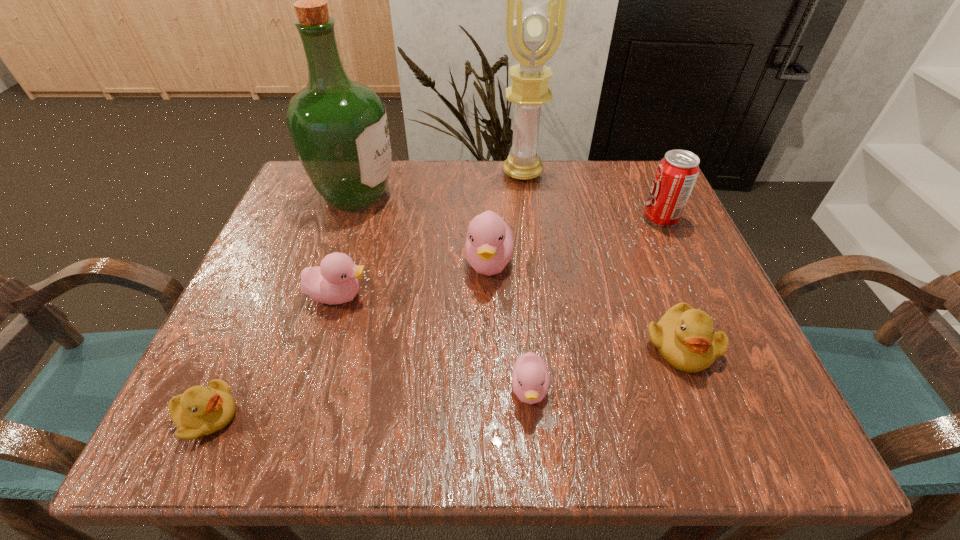
Identify the location of liquor. (339, 128).

Where is `award`? The image size is (960, 540). award is located at coordinates 534,34.

The width and height of the screenshot is (960, 540). In order to click on soda in this screenshot , I will do tap(676, 174).

You are a GUI agent. You are given a task and a screenshot of the screen. Output one action in this format:
    pyautogui.click(x=<x>, y=<y>)
    Task: Click on the fourth tallest object
    Image resolution: width=960 pixels, height=540 pixels.
    Given the screenshot: What is the action you would take?
    pyautogui.click(x=489, y=244)

At what (x,y) coordinates should I click in order to perform the action: click on the biggest pink duckling. Please return your answer as a coordinate pair (x, y). Image resolution: width=960 pixels, height=540 pixels. Looking at the image, I should click on (489, 244).

The width and height of the screenshot is (960, 540). I want to click on the leftmost pink duckling, so click(335, 281).

Locate an element on the screen. the second smallest pink duckling is located at coordinates (335, 281).

Locate an element on the screen. The height and width of the screenshot is (540, 960). the rightmost duckling is located at coordinates (685, 337).

This screenshot has width=960, height=540. In order to click on the right yellow duckling in this screenshot , I will do 685,337.

Identify the location of the nearest pink duckling. [x=530, y=379].